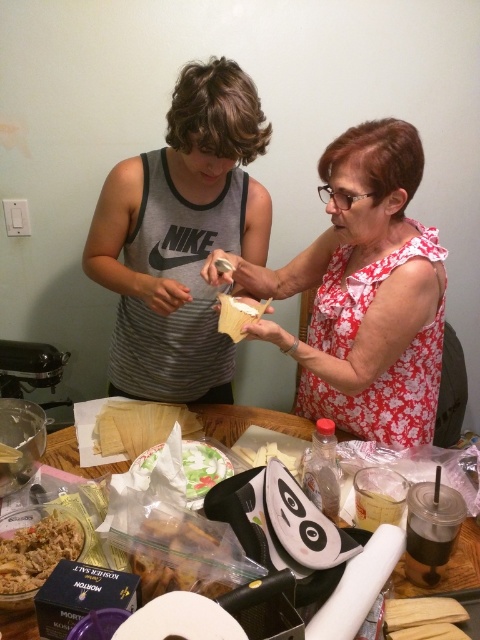
In the scene shown: Does gray striped tank top at center lie behind wooden table at center?

No.

This screenshot has width=480, height=640. Describe the element at coordinates (180, 237) in the screenshot. I see `gray striped tank top at center` at that location.

Find the location of a particular element. gray striped tank top at center is located at coordinates (180, 237).

Who is lower down, floral fabric blouse at center or brown crispy snack at center?

Positioned lower is brown crispy snack at center.

Between floral fabric blouse at center and brown crispy snack at center, which one is positioned higher?

floral fabric blouse at center is above.

Describe the element at coordinates (363, 292) in the screenshot. The image size is (480, 640). I see `floral fabric blouse at center` at that location.

Locate an element on the screen. This screenshot has height=640, width=480. floral fabric blouse at center is located at coordinates (363, 292).

Does gray striped tank top at center come in front of floral fabric blouse at center?

No.

Consider the image. Who is positioned more to the left, gray striped tank top at center or floral fabric blouse at center?

gray striped tank top at center is more to the left.

Where is `gray striped tank top at center`? gray striped tank top at center is located at coordinates (x=180, y=237).